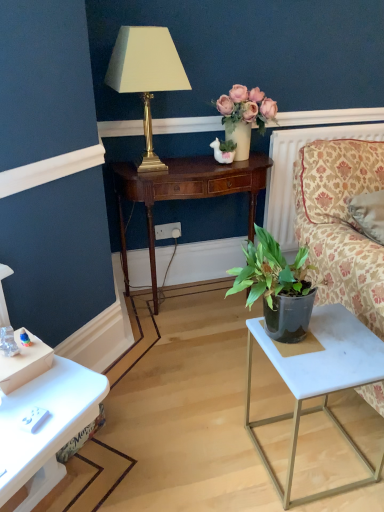
You are a GUI agent. You are given a task and a screenshot of the screen. Output one action in this format:
    pyautogui.click(x=<x>, y=<y>)
    Task: Click on the free space below white marble side table at lower right (from a real-world perspective)
    The width and height of the screenshot is (384, 512).
    Given the screenshot: What is the action you would take?
    pyautogui.click(x=308, y=457)